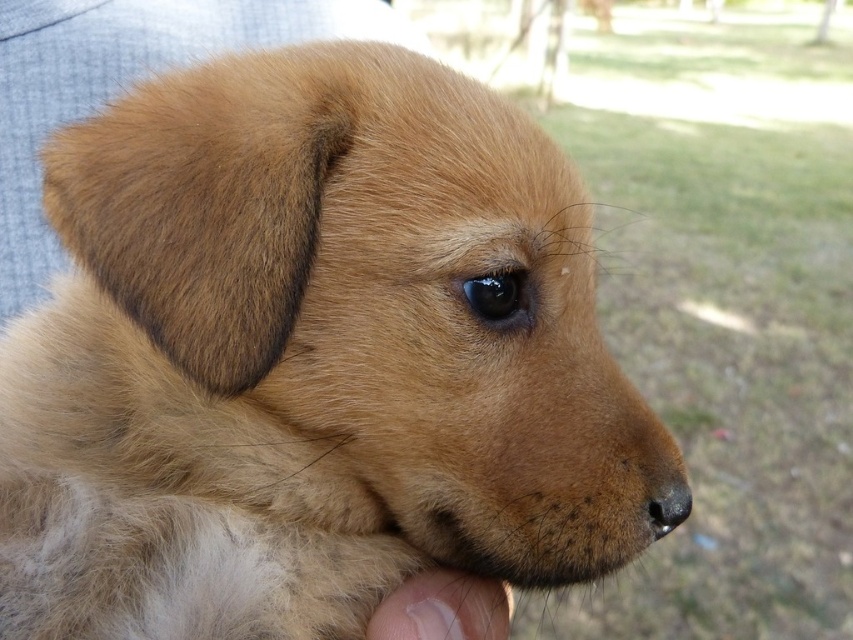
Is white skin at lower center thinner than brown matte nose at lower center?

Incorrect, white skin at lower center's width is not less than brown matte nose at lower center's.

Can you confirm if white skin at lower center is taller than brown matte nose at lower center?

Yes, white skin at lower center is taller than brown matte nose at lower center.

I want to click on white skin at lower center, so click(444, 609).